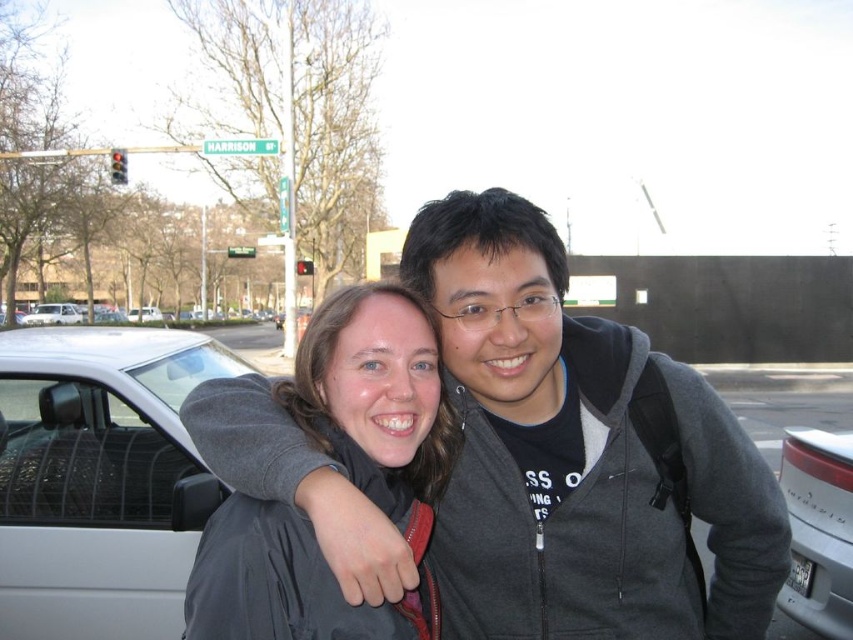
Question: Can you confirm if silver metallic car at left is positioned above white matte van at left?

Choices:
 (A) no
 (B) yes

Answer: (A)

Question: Is silver metallic car at left smaller than matte gray jacket at center?

Choices:
 (A) no
 (B) yes

Answer: (A)

Question: Which object appears farthest from the camera in this image?

Choices:
 (A) gray zip-up hoodie at center
 (B) silver metallic car at left

Answer: (B)

Question: Which object appears farthest from the camera in this image?

Choices:
 (A) silver metallic car at left
 (B) silver metallic car at lower right
 (C) gray zip-up hoodie at center
 (D) matte gray jacket at center

Answer: (B)

Question: Among these points, which one is nearest to the camera?

Choices:
 (A) (148, 307)
 (B) (134, 372)

Answer: (B)

Question: Is silver metallic car at left below silver metallic sedan at left?

Choices:
 (A) no
 (B) yes

Answer: (B)